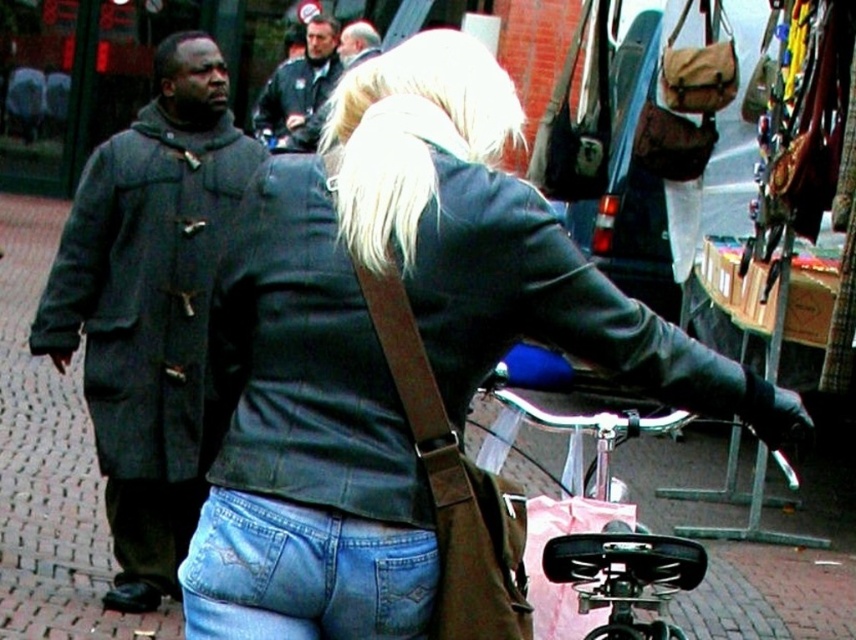
Is dark gray wool trench coat at left to the left of denim jeans at lower center from the viewer's perspective?

Indeed, dark gray wool trench coat at left is positioned on the left side of denim jeans at lower center.

Who is more distant from viewer, [195,154] or [206,506]?

The point [195,154] is behind.

Where is `dark gray wool trench coat at left`? This screenshot has height=640, width=856. dark gray wool trench coat at left is located at coordinates (149, 305).

Does matte black jacket at center appear on the right side of brown leather bag at center?

Correct, you'll find matte black jacket at center to the right of brown leather bag at center.

Does matte black jacket at center appear under brown leather bag at center?

Incorrect, matte black jacket at center is not positioned below brown leather bag at center.

Is point (274, 472) farther from camera compared to point (459, 513)?

No, (274, 472) is closer to viewer.

You are a GUI agent. You are given a task and a screenshot of the screen. Output one action in this format:
    pyautogui.click(x=<x>, y=<y>)
    Task: Click on the matte black jacket at center
    Image resolution: width=856 pixels, height=640 pixels.
    Given the screenshot: What is the action you would take?
    (302, 362)

Who is positioned more to the left, dark gray wool trench coat at left or dark green leather jacket at upper center?

dark gray wool trench coat at left is more to the left.

What do you see at coordinates (149, 305) in the screenshot? The width and height of the screenshot is (856, 640). I see `dark gray wool trench coat at left` at bounding box center [149, 305].

In order to click on dark gray wool trench coat at left in this screenshot , I will do `click(149, 305)`.